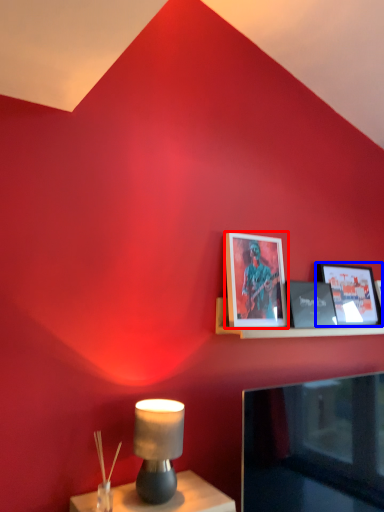
Question: Which of the following is the farthest to the observer, picture frame (highlighted by a red box) or picture frame (highlighted by a blue box)?

Choices:
 (A) picture frame
 (B) picture frame

Answer: (B)